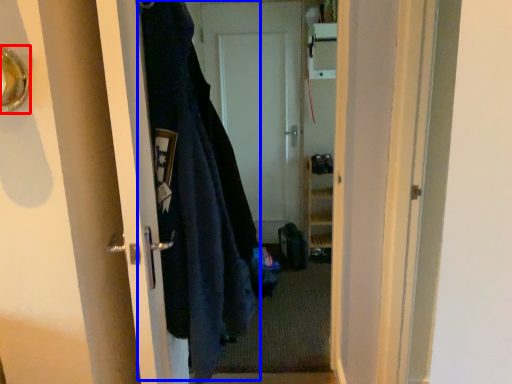
Question: Which of the following is the closest to the observer, door handle (highlighted by a red box) or garment (highlighted by a blue box)?

Choices:
 (A) door handle
 (B) garment

Answer: (A)